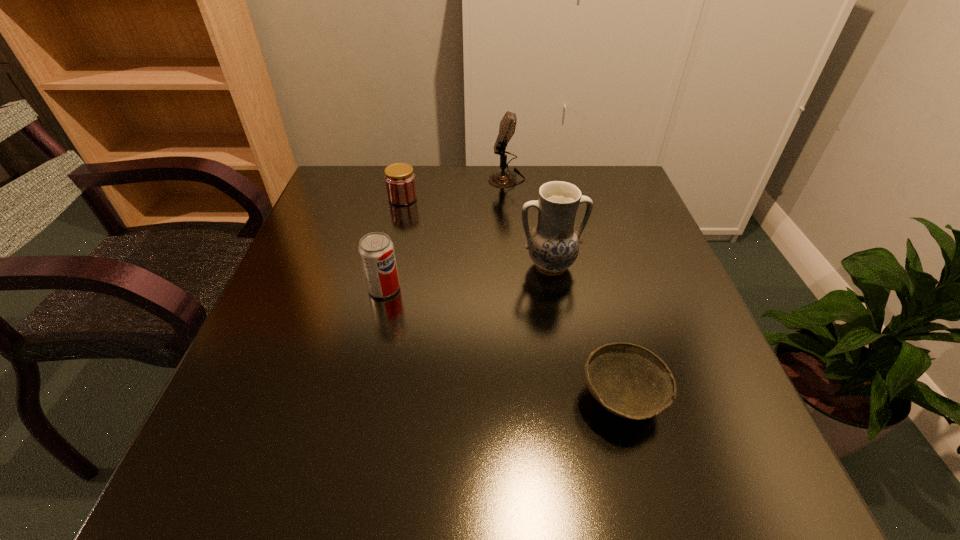
You are a GUI agent. You are given a task and a screenshot of the screen. Output one action in this format:
    pyautogui.click(x=<x>, y=<y>)
    Task: Click on the unoccupied position between the shortest object and the farthest object
    The height and width of the screenshot is (540, 960).
    Given the screenshot: What is the action you would take?
    pyautogui.click(x=564, y=288)

Where is `vacant space that is in between the fourth tallest object and the shortest object`? The height and width of the screenshot is (540, 960). vacant space that is in between the fourth tallest object and the shortest object is located at coordinates (512, 298).

Identify the location of empty space that is in between the farthest object and the pottery. The width and height of the screenshot is (960, 540). 528,222.

Select which object appears as the third closest to the soda. Please provide its 2D coordinates. Your answer should be formatted as a tuple, i.e. [(x, y)], where the tuple contains the x and y coordinates of a point satisfying the conditions above.

[(630, 381)]

Identify which object is the third closest to the third shortest object. Please provide its 2D coordinates. Your answer should be formatted as a tuple, i.e. [(x, y)], where the tuple contains the x and y coordinates of a point satisfying the conditions above.

[(630, 381)]

This screenshot has height=540, width=960. Find the location of `free space that satisfies the following two spatial constraints: 1. on the front-facing side of the farthest object; 2. on the front side of the jam`. free space that satisfies the following two spatial constraints: 1. on the front-facing side of the farthest object; 2. on the front side of the jam is located at coordinates (509, 198).

Locate an element on the screen. free point that satisfies the following two spatial constraints: 1. on the front side of the second shortest object; 2. on the left side of the shortest object is located at coordinates (356, 399).

This screenshot has height=540, width=960. In order to click on free spot that satisfies the following two spatial constraints: 1. on the front-facing side of the shortest object; 2. on the right side of the farthest object in this screenshot , I will do `click(525, 399)`.

I want to click on free space that satisfies the following two spatial constraints: 1. on the front side of the pottery; 2. on the right side of the second farthest object, so click(387, 265).

Locate an element on the screen. Image resolution: width=960 pixels, height=540 pixels. blank area in the image that satisfies the following two spatial constraints: 1. on the front-facing side of the microphone; 2. on the right side of the bowl is located at coordinates (525, 399).